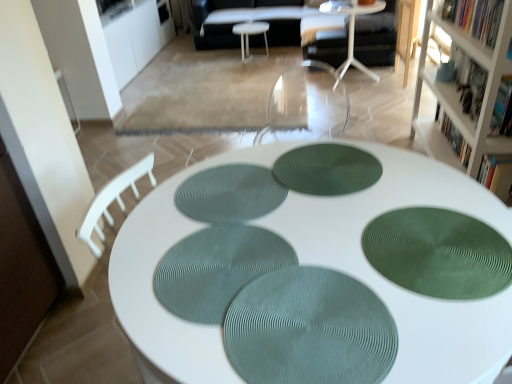
Find the location of `free space that is to the left of green textured placemat at center, the 2th mat viewed from the right`. free space that is to the left of green textured placemat at center, the 2th mat viewed from the right is located at coordinates (231, 187).